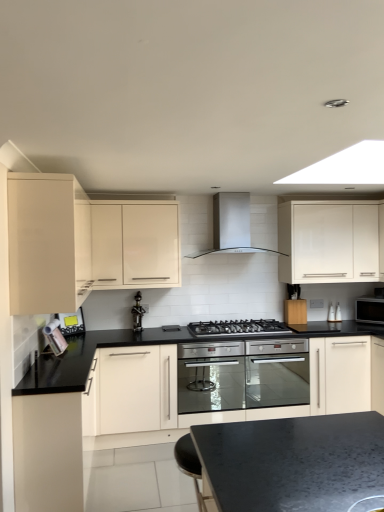
Question: Visually, is white glossy cabinet at upper center, the second cabinetry in the right-to-left sequence, positioned to the left or to the right of white glossy cabinet at upper right, the first cabinetry positioned from the right?

Choices:
 (A) right
 (B) left

Answer: (B)

Question: Considering the positions of white glossy cabinet at upper center, the second cabinetry in the right-to-left sequence, and white glossy cabinet at upper right, the 3th cabinetry when ordered from left to right, in the image, is white glossy cabinet at upper center, the second cabinetry in the right-to-left sequence, wider or thinner than white glossy cabinet at upper right, the 3th cabinetry when ordered from left to right,?

Choices:
 (A) wide
 (B) thin

Answer: (A)

Question: Which is nearer to the white glossy cabinet at upper center, acting as the 2th cabinetry starting from the left?

Choices:
 (A) satin silver range hood at center
 (B) black matte gas stove at center
 (C) white glossy cabinet at upper right, the first cabinetry positioned from the right
 (D) black glass microwave at right, the third appliance in the left-to-right sequence
 (E) metallic black wine rack at center, the second appliance in the front-to-back sequence

Answer: (E)

Question: Estimate the real-world distances between objects in this image. Which object is closer to the black matte gas stove at center?

Choices:
 (A) metallic black wine rack at center, the second appliance in the front-to-back sequence
 (B) black glass microwave at right, the 1th appliance when ordered from back to front
 (C) satin silver range hood at center
 (D) white glossy cabinet at upper center, acting as the 2th cabinetry starting from the left
 (E) matte cream cabinet at left, the third cabinetry viewed from the right

Answer: (A)